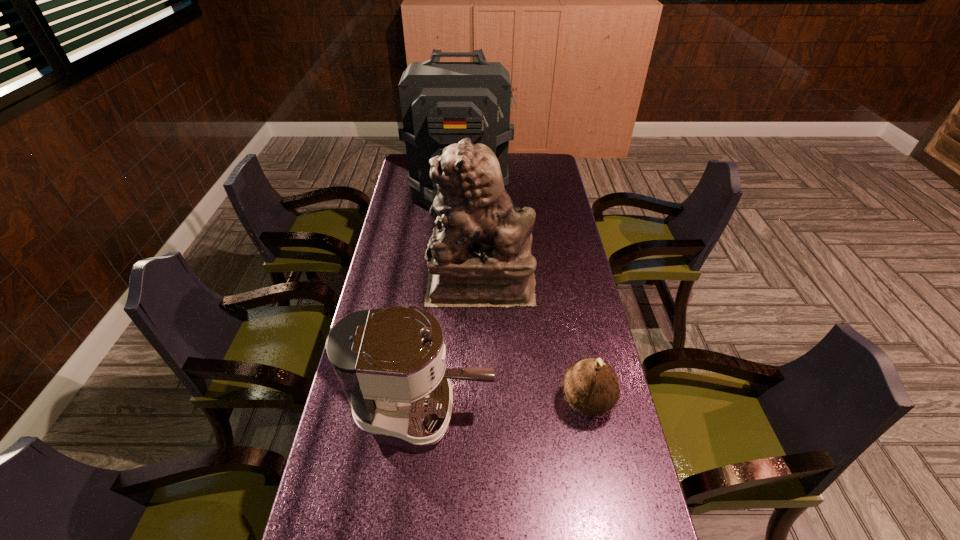
Locate an element on the screen. vacant space located 0.310m on the surface of the shortest object is located at coordinates (446, 401).

Identify the location of vacant area situated 0.310m on the surface of the shortest object. The width and height of the screenshot is (960, 540). (446, 401).

This screenshot has height=540, width=960. In order to click on vacant area located on the surface of the shortest object in this screenshot , I will do `click(457, 401)`.

What are the coordinates of `object present at the far edge` in the screenshot? It's located at (442, 103).

At what (x,y) coordinates should I click in order to perform the action: click on backpack situated at the left edge. Please return your answer as a coordinate pair (x, y). Looking at the image, I should click on (442, 103).

Find the location of a particular element. This screenshot has height=540, width=960. coffee maker situated at the left edge is located at coordinates (390, 363).

In order to click on object that is at the right edge in this screenshot , I will do `click(591, 386)`.

At what (x,y) coordinates should I click in order to perform the action: click on object located at the far left corner. Please return your answer as a coordinate pair (x, y). Image resolution: width=960 pixels, height=540 pixels. Looking at the image, I should click on (442, 103).

Identify the location of free space at the left edge of the desktop. The image size is (960, 540). coord(425,221).

In the image, there is a desktop. At what (x,y) coordinates should I click in order to perform the action: click on vacant space at the right edge. Please return your answer as a coordinate pair (x, y). The image size is (960, 540). Looking at the image, I should click on (560, 250).